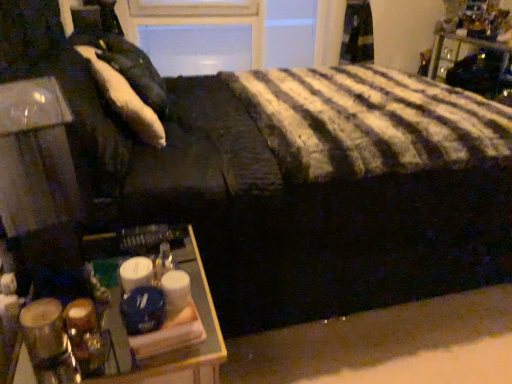
Question: Looking at their shapes, would you say white soft pillow at upper left is wider or thinner than metallic black nightstand at upper right?

Choices:
 (A) wide
 (B) thin

Answer: (B)

Question: Based on their positions, is white soft pillow at upper left located to the left or right of metallic black nightstand at upper right?

Choices:
 (A) left
 (B) right

Answer: (A)

Question: Which object is the closest to the white soft pillow at upper left?

Choices:
 (A) wooden tray at lower left
 (B) metallic black nightstand at upper right

Answer: (A)

Question: Which is farther from the metallic black nightstand at upper right?

Choices:
 (A) white soft pillow at upper left
 (B) wooden tray at lower left

Answer: (B)